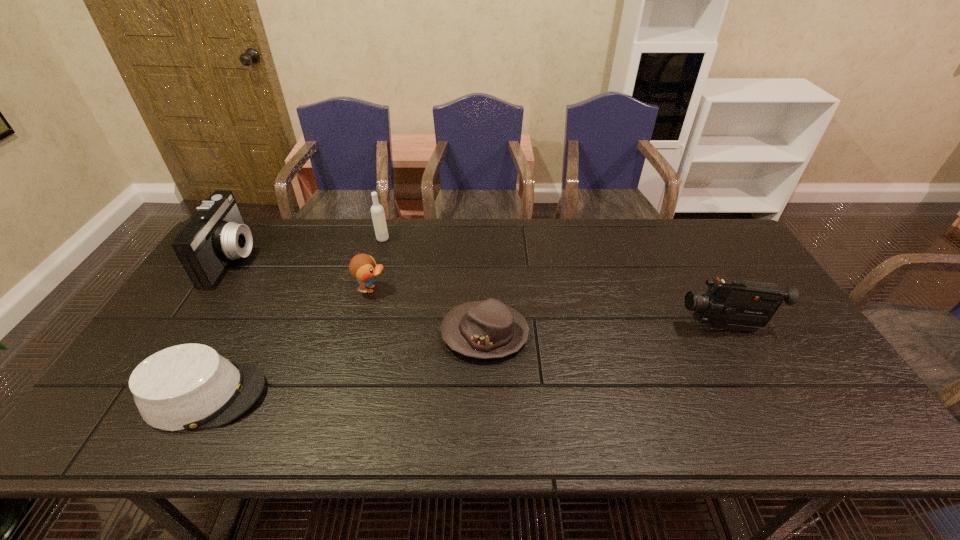
The height and width of the screenshot is (540, 960). Find the location of `vodka`. vodka is located at coordinates (377, 211).

The height and width of the screenshot is (540, 960). I want to click on the farther camcorder, so click(x=216, y=232).

Identify the location of the rightmost object. The height and width of the screenshot is (540, 960). (733, 304).

This screenshot has width=960, height=540. Identify the location of the nearer camcorder. (733, 304).

Identify the location of duck. The width and height of the screenshot is (960, 540). [x=362, y=267].

I want to click on the left hat, so click(x=190, y=386).

Identify the location of the right hat. (488, 329).

Where is `vacant space located 0.320m on the front of the vodka`? This screenshot has height=540, width=960. vacant space located 0.320m on the front of the vodka is located at coordinates tap(363, 311).

At what (x,y) coordinates should I click in order to perform the action: click on vacant position located on the lens of the farther camcorder. Please return your answer as a coordinate pair (x, y). The height and width of the screenshot is (540, 960). Looking at the image, I should click on (267, 258).

Identify the location of vacant space located on the front-facing side of the nearer camcorder. Image resolution: width=960 pixels, height=540 pixels. (597, 327).